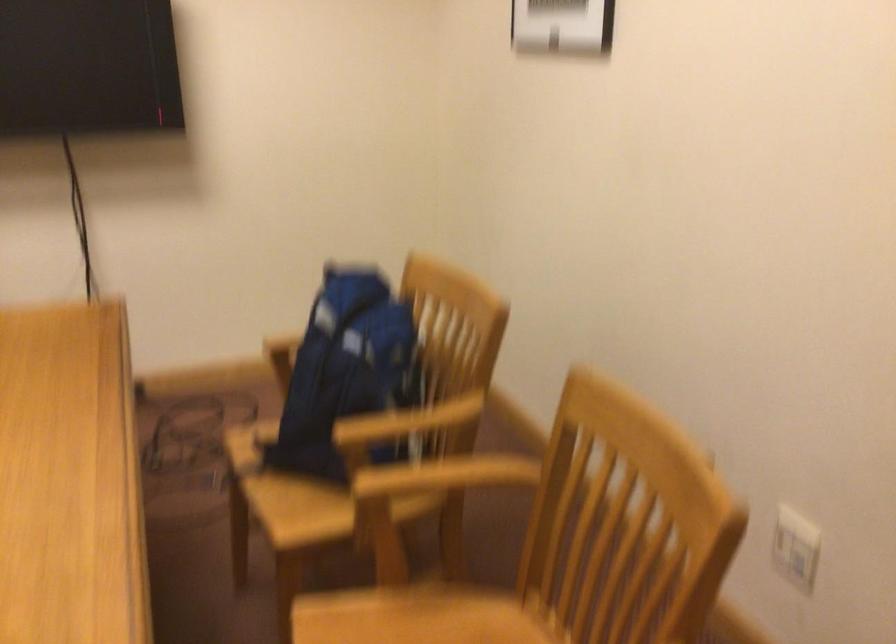
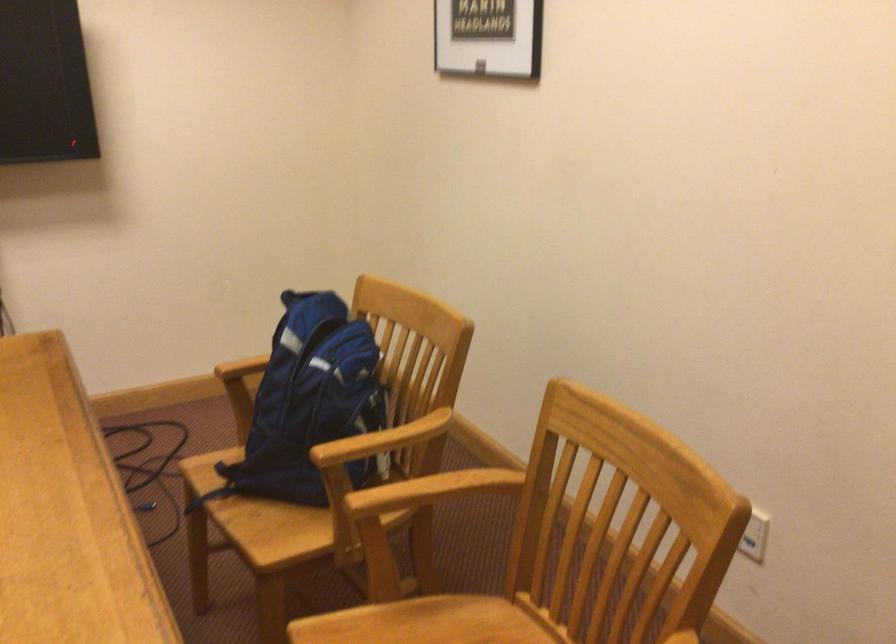
The point at (288, 341) is marked in the first image. Where is the corresponding point in the second image?

(242, 368)